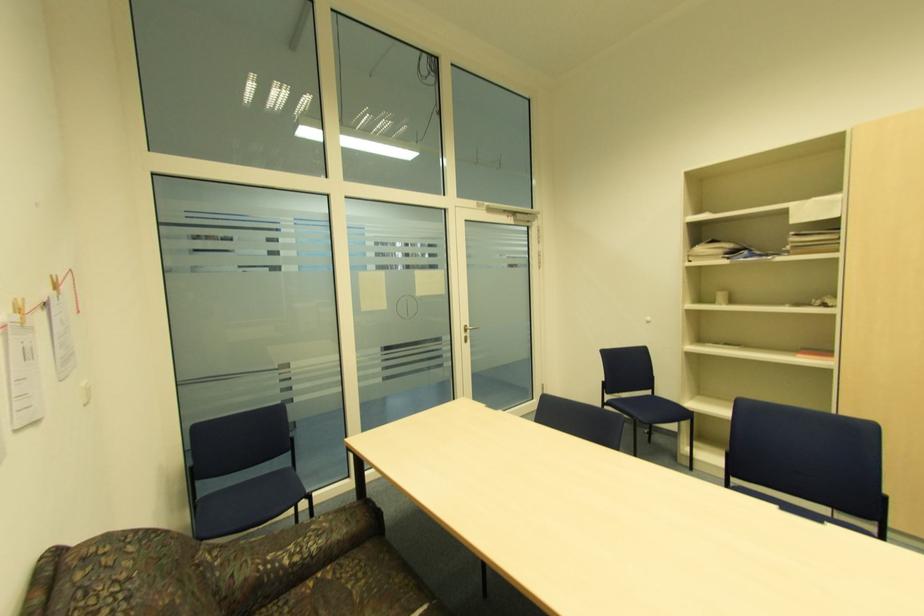
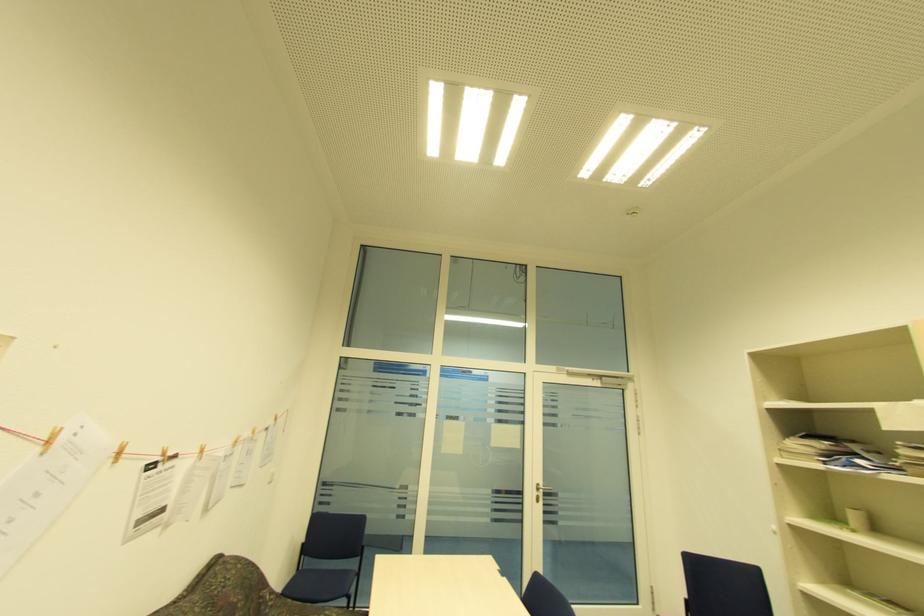
Locate, in the second image, the point that corresponds to (724,296) in the first image.

(857, 517)